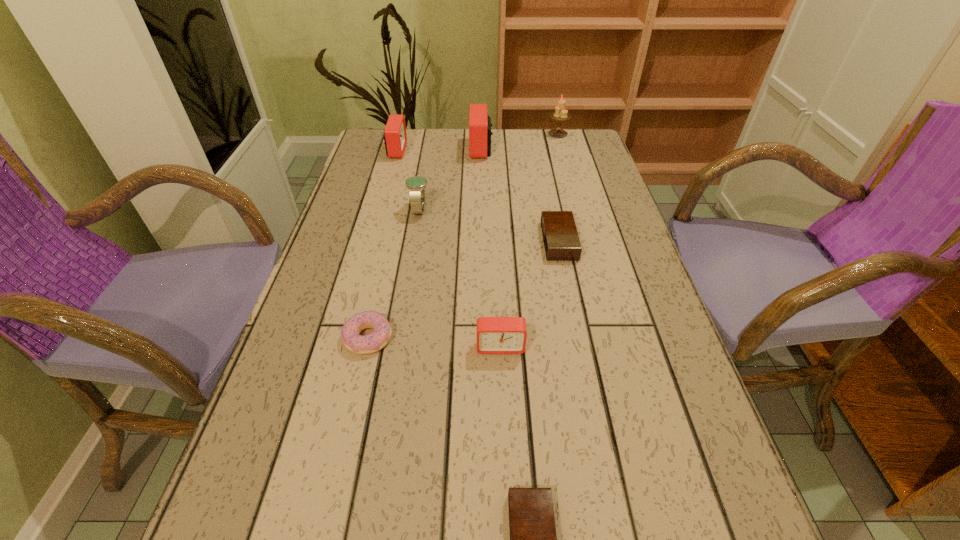
Locate an element on the screen. alarm clock that is the second closest to the fourth shortest object is located at coordinates (533, 539).

Identify which red alarm clock is the nearest to the biggest red alarm clock. Please provide its 2D coordinates. Your answer should be formatted as a tuple, i.e. [(x, y)], where the tuple contains the x and y coordinates of a point satisfying the conditions above.

[(395, 138)]

Locate an element on the screen. red alarm clock that is the closest to the shortest alarm clock is located at coordinates (495, 335).

Locate an element on the screen. The height and width of the screenshot is (540, 960). black alarm clock that is the closest to the candle holder is located at coordinates (561, 241).

At what (x,y) coordinates should I click in order to perform the action: click on black alarm clock that is the second nearest to the candle holder. Please return your answer as a coordinate pair (x, y). Image resolution: width=960 pixels, height=540 pixels. Looking at the image, I should click on coord(533,539).

Locate an element on the screen. This screenshot has width=960, height=540. free region that satisfies the following two spatial constraints: 1. on the back side of the doughnut; 2. on the left side of the candle holder is located at coordinates (415, 134).

Image resolution: width=960 pixels, height=540 pixels. In order to click on free space that satisfies the following two spatial constraints: 1. on the front-facing side of the doughnut; 2. on the right side of the leftmost alarm clock in this screenshot , I will do `click(345, 338)`.

Find the location of a particular element. The height and width of the screenshot is (540, 960). blank space that satisfies the following two spatial constraints: 1. on the front-facing side of the fifth nearest object; 2. on the left side of the fourth shortest alarm clock is located at coordinates (380, 210).